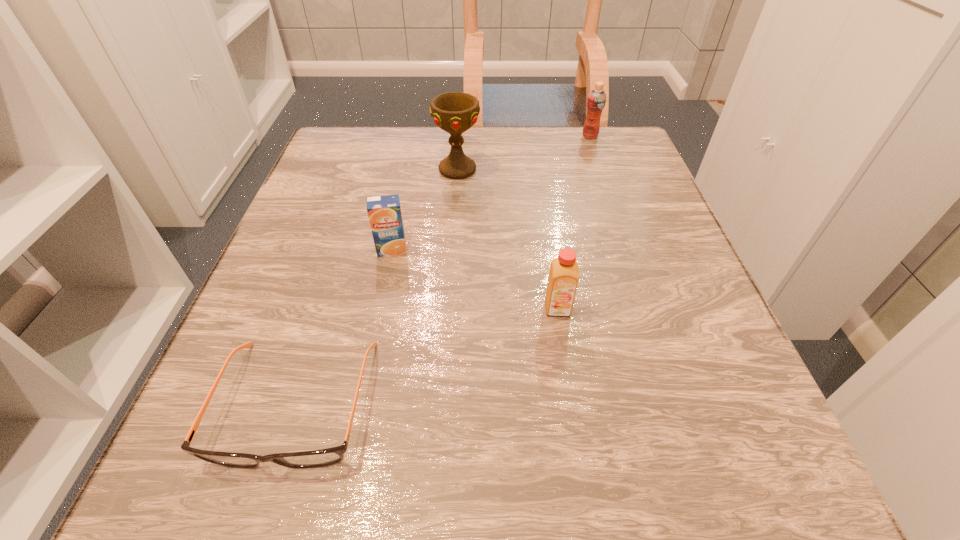
Locate an element on the screen. object that is at the far right corner is located at coordinates (596, 100).

This screenshot has height=540, width=960. In the image, there is a desktop. Identify the location of vacant space at the far edge. (473, 127).

Locate an element on the screen. Image resolution: width=960 pixels, height=540 pixels. vacant area at the left edge is located at coordinates (317, 276).

Where is `vacant space at the right edge of the desktop`? vacant space at the right edge of the desktop is located at coordinates (638, 426).

Where is `free space at the far left corner`? This screenshot has height=540, width=960. free space at the far left corner is located at coordinates (344, 154).

Image resolution: width=960 pixels, height=540 pixels. Find the location of `vacant space at the near left corner of the desktop`. vacant space at the near left corner of the desktop is located at coordinates (190, 498).

Identify the location of free space between the third farthest object and the farthest object. (491, 193).

What are the coordinates of `free space between the third farthest object and the rightmost orange_juice` in the screenshot? It's located at (491, 193).

Identify the location of vacant area that lies between the nearest object and the third object from right to left. (376, 286).

What are the coordinates of `free space that is in between the nearest orange_juice and the third object from left to right` in the screenshot? It's located at click(508, 239).